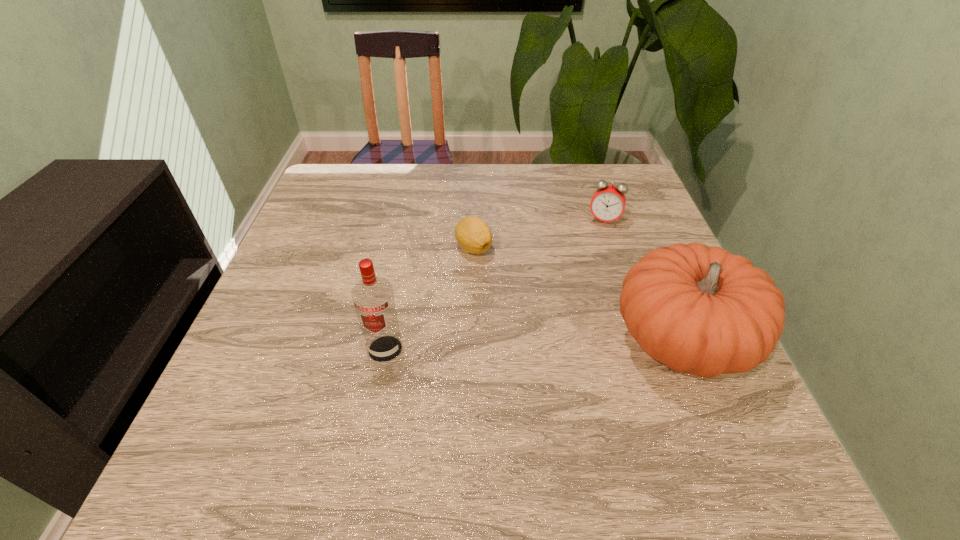
Image resolution: width=960 pixels, height=540 pixels. Find the location of `free space between the pumpkin and the leftmost object`. free space between the pumpkin and the leftmost object is located at coordinates (534, 345).

Where is `empty location between the third nearest object and the tallest object`? empty location between the third nearest object and the tallest object is located at coordinates pyautogui.click(x=429, y=299).

At what (x,y) coordinates should I click in order to perform the action: click on vacant area that lies between the third shortest object and the shortest object. Please return your answer as a coordinate pair (x, y). This screenshot has height=540, width=960. Looking at the image, I should click on (578, 294).

In order to click on free space between the tallest object and the second tallest object in this screenshot , I will do `click(534, 345)`.

Locate which object ranks second in proximity to the second farthest object. Please provide its 2D coordinates. Your answer should be formatted as a tuple, i.e. [(x, y)], where the tuple contains the x and y coordinates of a point satisfying the conditions above.

[(699, 310)]

Point out which object is positioned as the third nearest to the third nearest object. Please provide its 2D coordinates. Your answer should be formatted as a tuple, i.e. [(x, y)], where the tuple contains the x and y coordinates of a point satisfying the conditions above.

[(608, 202)]